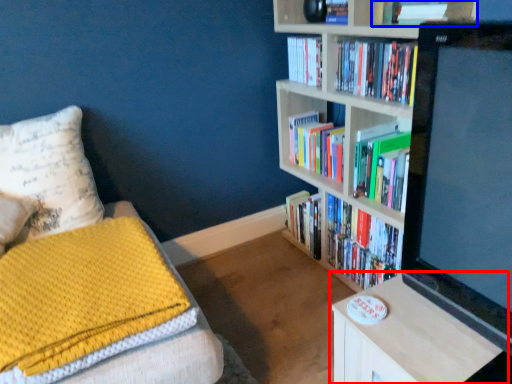
Question: Among these objects, which one is nearest to the camera, table (highlighted by a red box) or book (highlighted by a blue box)?

Choices:
 (A) table
 (B) book

Answer: (A)